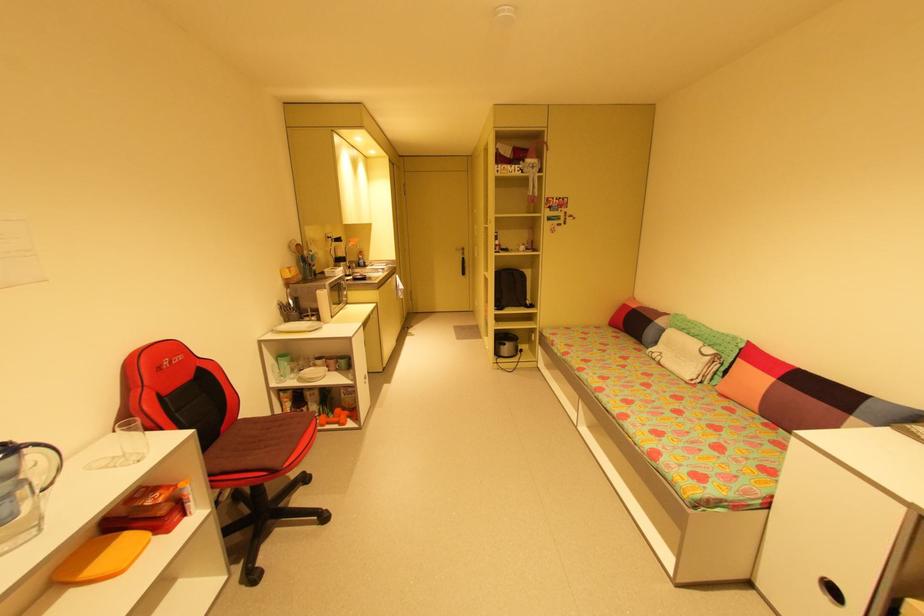
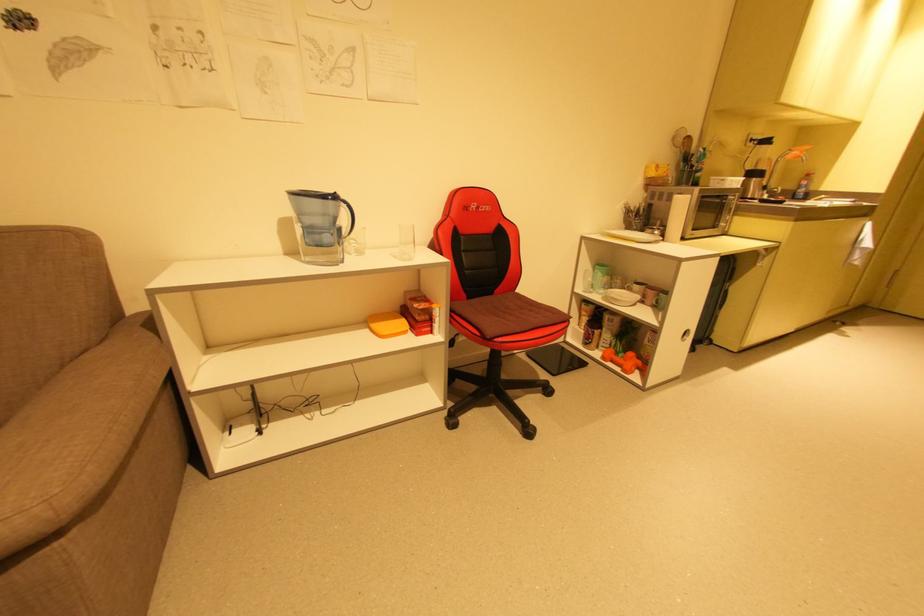
In the second image, find the point that corresponds to [119,468] in the first image.

(400, 257)